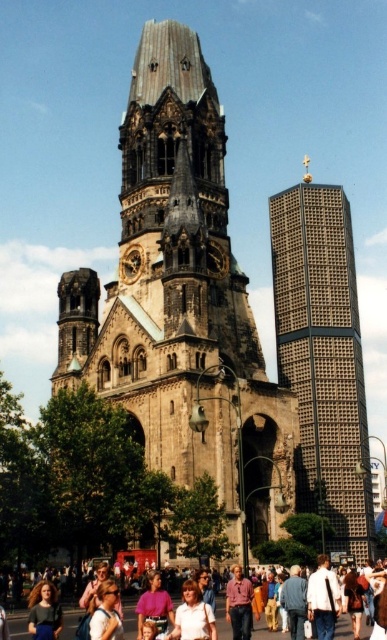
Question: Which of the following is the closest to the observer?

Choices:
 (A) (202, 627)
 (B) (155, 573)
 (C) (227, 630)

Answer: (A)

Question: Can you confirm if matte pink shirts at lower center is wider than matte purple blouse at center?

Choices:
 (A) no
 (B) yes

Answer: (B)

Question: Based on their relative distances, which object is farther from the matte purple blouse at center?

Choices:
 (A) gray textured skyscraper at right
 (B) light pink fabric shirt at center

Answer: (A)

Question: Does dark gray stone tower at center appear under gray textured skyscraper at right?

Choices:
 (A) no
 (B) yes

Answer: (B)

Question: Which point is farther to the camera?

Choices:
 (A) gray textured skyscraper at right
 (B) matte black backpack at lower center
 (C) matte pink shirts at lower center
 (D) white cotton shirt at center

Answer: (A)

Question: In this image, where is light pink fabric shirt at center located relative to matte black backpack at lower center?

Choices:
 (A) above
 (B) below

Answer: (B)